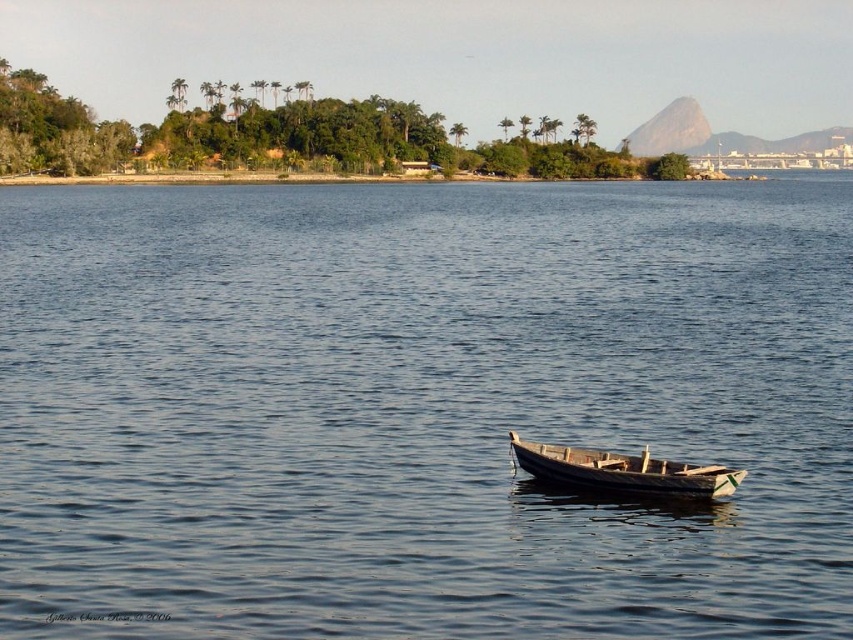
Is blue water at center positioned before wooden boat at center?

Yes, blue water at center is in front of wooden boat at center.

Consider the image. Which of these two, blue water at center or wooden boat at center, stands shorter?

wooden boat at center is shorter.

Image resolution: width=853 pixels, height=640 pixels. I want to click on blue water at center, so click(421, 408).